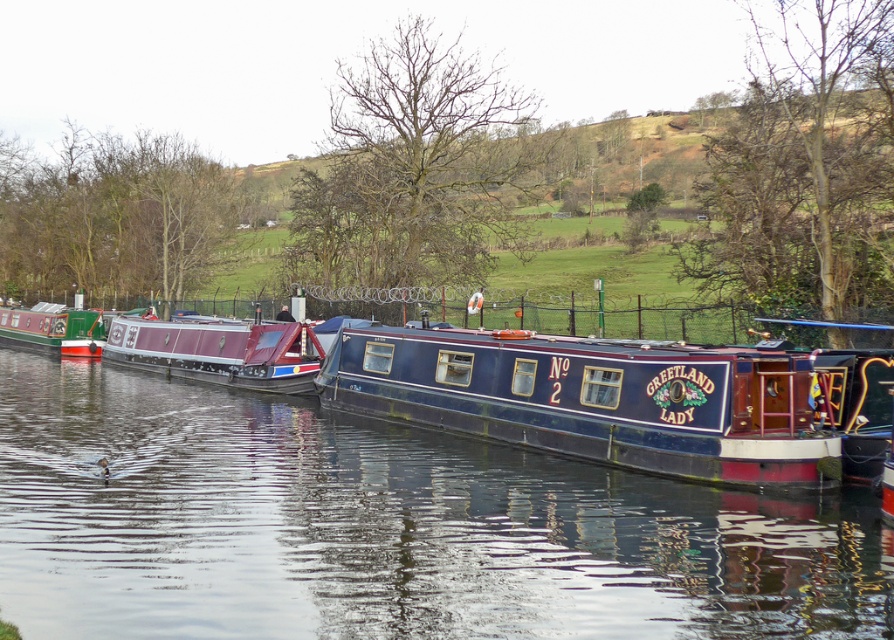
Question: Which of the following is the farthest from the observer?

Choices:
 (A) (727, 413)
 (B) (483, 483)
 (C) (251, 356)

Answer: (C)

Question: Can you confirm if blue painted wood barge at center is wider than maroon polished wood boat at center?

Choices:
 (A) yes
 (B) no

Answer: (B)

Question: Does blue painted wood barge at center lie behind green matte canal boat at left?

Choices:
 (A) no
 (B) yes

Answer: (A)

Question: Which point is closer to the camera?

Choices:
 (A) green matte canal boat at left
 (B) blue painted wood barge at center
 (C) glossy blue water at center

Answer: (C)

Question: Which point appears closest to the camera in this image?

Choices:
 (A) (486, 400)
 (B) (204, 346)

Answer: (A)

Question: Can you confirm if glossy blue water at center is thinner than blue painted wood barge at center?

Choices:
 (A) no
 (B) yes

Answer: (A)